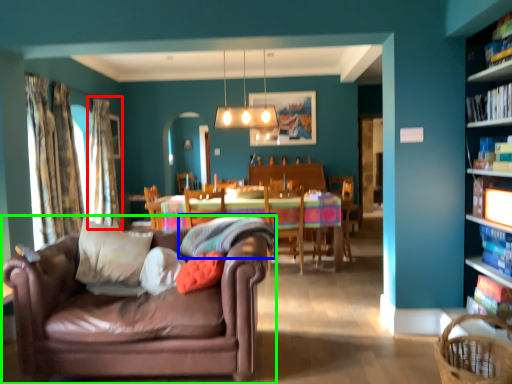
Question: Estimate the real-world distances between objects in this image. Which object is farther from curtain (highlighted by a red box), pillow (highlighted by a blue box) or studio couch (highlighted by a green box)?

Choices:
 (A) pillow
 (B) studio couch

Answer: (B)